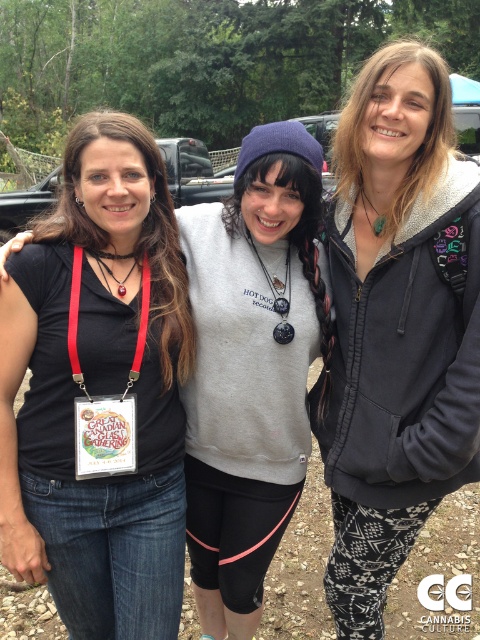
Does matte gray hoodie at center appear under black fabric lanyard at center?

No, matte gray hoodie at center is not below black fabric lanyard at center.

Is the position of matte gray hoodie at center less distant than that of black fabric lanyard at center?

Yes.

Does point (444, 172) come farther from viewer compared to point (292, 332)?

No, (444, 172) is closer to viewer.

Find the location of a particular element. The height and width of the screenshot is (640, 480). matte gray hoodie at center is located at coordinates (397, 326).

Which of these two, red fabric lanyard at center or matte red lanyard at center, stands shorter?

Standing shorter between the two is matte red lanyard at center.

Does red fabric lanyard at center appear on the right side of matte red lanyard at center?

Indeed, red fabric lanyard at center is positioned on the right side of matte red lanyard at center.

What do you see at coordinates (75, 321) in the screenshot? I see `red fabric lanyard at center` at bounding box center [75, 321].

At what (x,y) coordinates should I click in order to perform the action: click on red fabric lanyard at center. Please return your answer as a coordinate pair (x, y). Looking at the image, I should click on (75, 321).

Which is above, black fabric lanyard at center or matte red lanyard at center?

Positioned higher is matte red lanyard at center.

Is point (285, 285) less distant than point (105, 253)?

No, (285, 285) is behind (105, 253).

Image resolution: width=480 pixels, height=640 pixels. I want to click on black fabric lanyard at center, so click(277, 296).